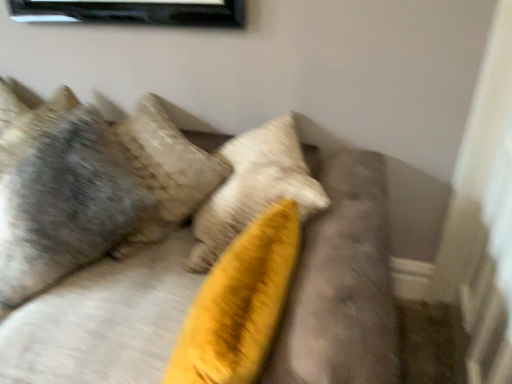
Question: From the image's perspective, is velvet yellow pillow at center above or below textured gray pillow at upper left?

Choices:
 (A) above
 (B) below

Answer: (B)

Question: Is velvet yellow pillow at center situated inside textured gray pillow at upper left or outside?

Choices:
 (A) outside
 (B) inside

Answer: (A)

Question: Is velvet yellow pillow at center in front of or behind textured gray pillow at upper left in the image?

Choices:
 (A) behind
 (B) front

Answer: (B)

Question: From a real-world perspective, is textured gray pillow at upper left physically located above or below velvet yellow pillow at center?

Choices:
 (A) above
 (B) below

Answer: (A)

Question: Considering the positions of textured gray pillow at upper left and velvet yellow pillow at center in the image, is textured gray pillow at upper left taller or shorter than velvet yellow pillow at center?

Choices:
 (A) short
 (B) tall

Answer: (B)

Question: Based on their positions, is textured gray pillow at upper left located to the left or right of velvet yellow pillow at center?

Choices:
 (A) right
 (B) left

Answer: (B)

Question: Considering the positions of point (8, 99) and point (128, 336), is point (8, 99) closer or farther from the camera than point (128, 336)?

Choices:
 (A) closer
 (B) farther

Answer: (B)